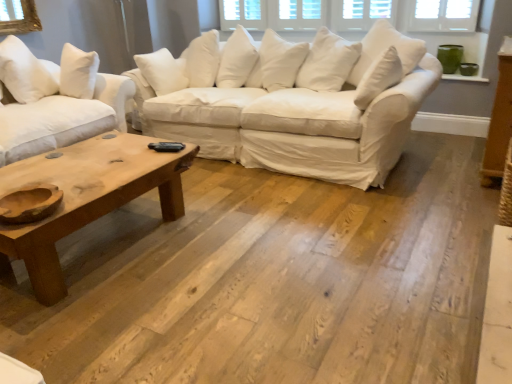
Question: Is white cotton pillow at upper left wider than white cotton couch at center, which is counted as the 2th studio couch, starting from the left?

Choices:
 (A) yes
 (B) no

Answer: (B)

Question: From the image's perspective, is white cotton pillow at upper left beneath white cotton couch at center, which is counted as the 2th studio couch, starting from the left?

Choices:
 (A) no
 (B) yes

Answer: (A)

Question: Considering the relative sizes of white cotton pillow at upper left and white cotton couch at center, acting as the 1th studio couch starting from the right, in the image provided, is white cotton pillow at upper left shorter than white cotton couch at center, acting as the 1th studio couch starting from the right,?

Choices:
 (A) no
 (B) yes

Answer: (B)

Question: Could white cotton couch at center, which is counted as the 2th studio couch, starting from the left, be considered to be inside white cotton pillow at upper left?

Choices:
 (A) yes
 (B) no

Answer: (B)

Question: Does white cotton pillow at upper left appear on the left side of white cotton couch at center, which is counted as the 2th studio couch, starting from the left?

Choices:
 (A) no
 (B) yes

Answer: (B)

Question: Is natural wood studio couch at left, which appears as the first studio couch when viewed from the left, wider or thinner than white cotton pillow at upper left?

Choices:
 (A) wide
 (B) thin

Answer: (A)

Question: Considering the positions of natural wood studio couch at left, which appears as the first studio couch when viewed from the left, and white cotton pillow at upper left in the image, is natural wood studio couch at left, which appears as the first studio couch when viewed from the left, taller or shorter than white cotton pillow at upper left?

Choices:
 (A) tall
 (B) short

Answer: (A)

Question: Does point 104,122 appear closer or farther from the camera than point 32,66?

Choices:
 (A) closer
 (B) farther

Answer: (A)

Question: From the image's perspective, is natural wood studio couch at left, positioned as the second studio couch in right-to-left order, located above or below white cotton pillow at upper left?

Choices:
 (A) below
 (B) above

Answer: (A)

Question: Considering their positions, is white cotton couch at center, acting as the 1th studio couch starting from the right, located in front of or behind white cotton pillow at upper left?

Choices:
 (A) front
 (B) behind

Answer: (A)

Question: Is white cotton couch at center, which is counted as the 2th studio couch, starting from the left, inside or outside of white cotton pillow at upper left?

Choices:
 (A) inside
 (B) outside

Answer: (B)

Question: Based on their positions, is white cotton couch at center, which is counted as the 2th studio couch, starting from the left, located to the left or right of white cotton pillow at upper left?

Choices:
 (A) left
 (B) right

Answer: (B)

Question: Looking at the image, does white cotton couch at center, which is counted as the 2th studio couch, starting from the left, seem bigger or smaller compared to white cotton pillow at upper left?

Choices:
 (A) small
 (B) big

Answer: (B)

Question: Choose the correct answer: Is natural wood studio couch at left, which appears as the first studio couch when viewed from the left, inside white cotton couch at center, acting as the 1th studio couch starting from the right, or outside it?

Choices:
 (A) inside
 (B) outside

Answer: (B)

Question: From a real-world perspective, is natural wood studio couch at left, positioned as the second studio couch in right-to-left order, above or below white cotton couch at center, which is counted as the 2th studio couch, starting from the left?

Choices:
 (A) below
 (B) above

Answer: (B)